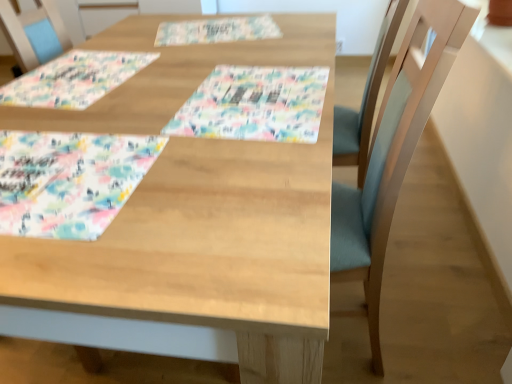
This screenshot has width=512, height=384. Identify the location of free space above floral paper placemat at upper center, which is the first place mat from top to bottom (from a real-world perspective). [212, 23].